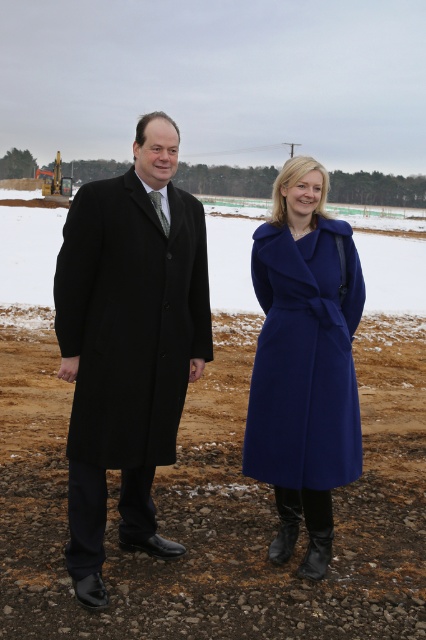
Question: Can you confirm if brown gravel at center is positioned below black wool coat at center?

Choices:
 (A) no
 (B) yes

Answer: (B)

Question: Can you confirm if black wool coat at center is positioned above matte blue coat at center?

Choices:
 (A) yes
 (B) no

Answer: (A)

Question: Based on their relative distances, which object is farther from the brown gravel at center?

Choices:
 (A) black wool coat at center
 (B) matte blue coat at center

Answer: (A)

Question: Does brown gravel at center appear under matte blue coat at center?

Choices:
 (A) yes
 (B) no

Answer: (A)

Question: Considering the real-world distances, which object is farthest from the matte blue coat at center?

Choices:
 (A) brown gravel at center
 (B) black wool coat at center

Answer: (A)

Question: Which point is closer to the camera taking this photo?

Choices:
 (A) click(51, 406)
 (B) click(141, 160)
 (C) click(316, 342)

Answer: (B)